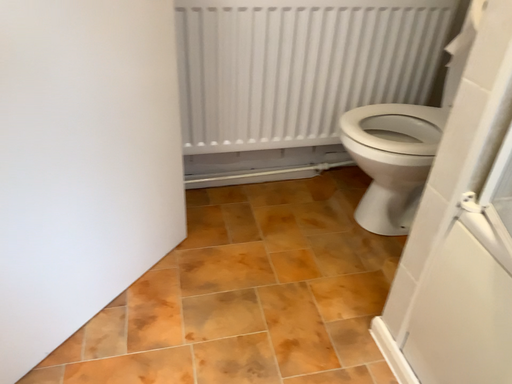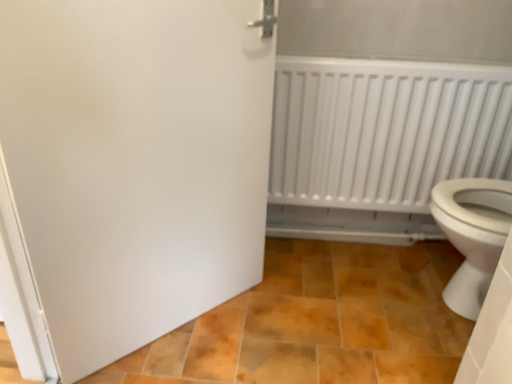
Question: Which way did the camera rotate in the video?

Choices:
 (A) rotated upward
 (B) rotated downward

Answer: (A)